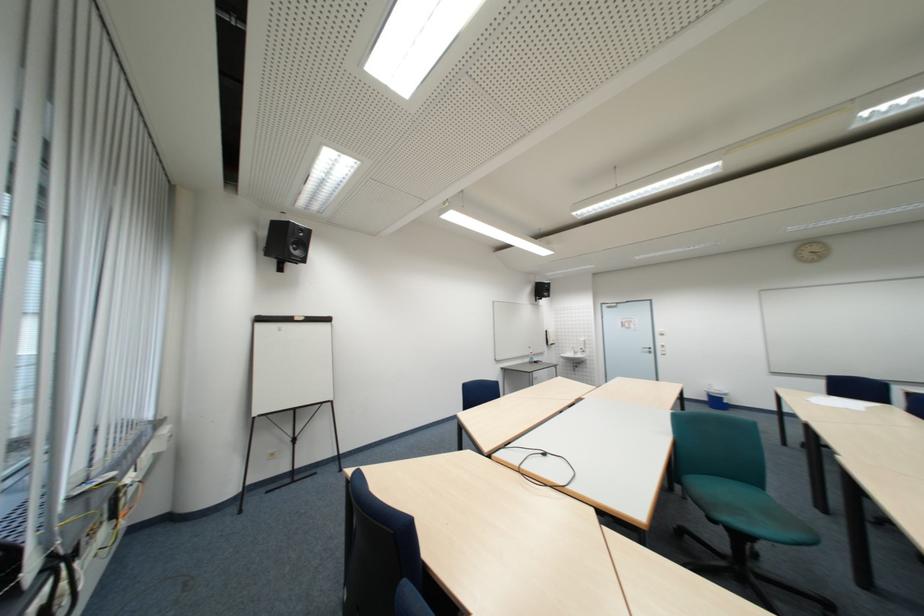
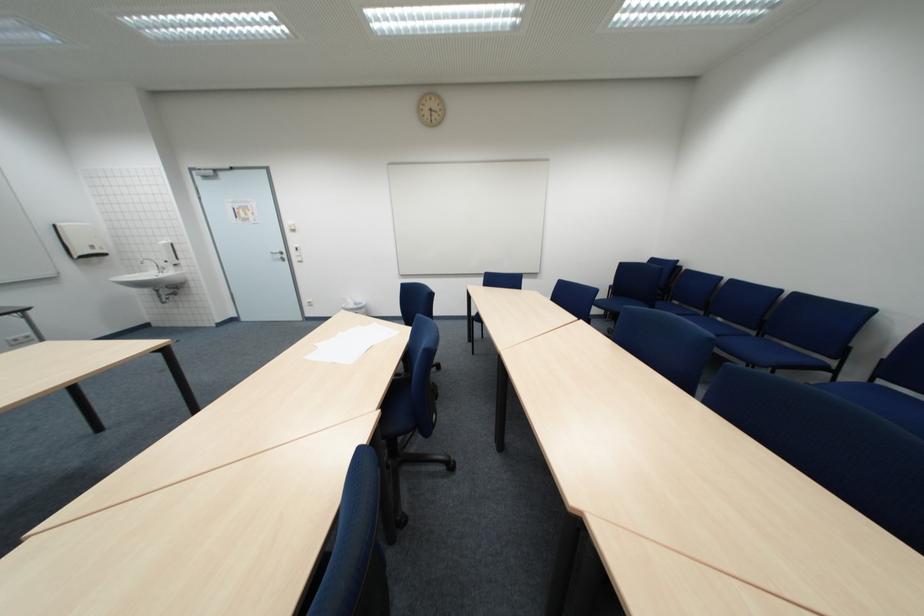
Find the pixel in the second image that matches (665,352) in the first image.

(299, 257)